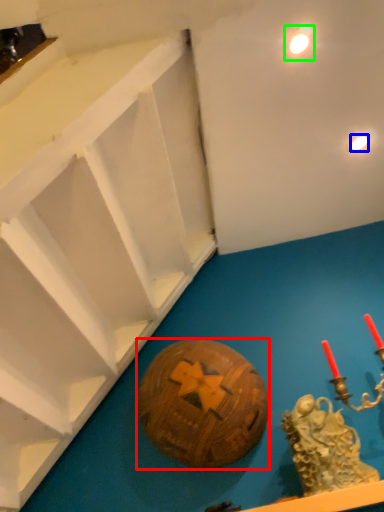
Question: Which object is the farthest from ball (highlighted by a red box)? Choose among these: light (highlighted by a blue box) or light (highlighted by a green box).

Choices:
 (A) light
 (B) light

Answer: (B)